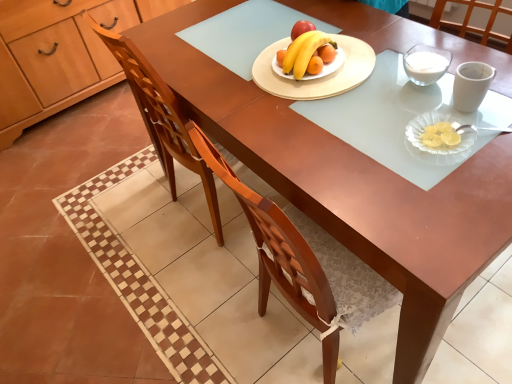
Locate an element on the screen. This screenshot has width=512, height=384. vacant area that is in front of wooden chair at center is located at coordinates (199, 278).